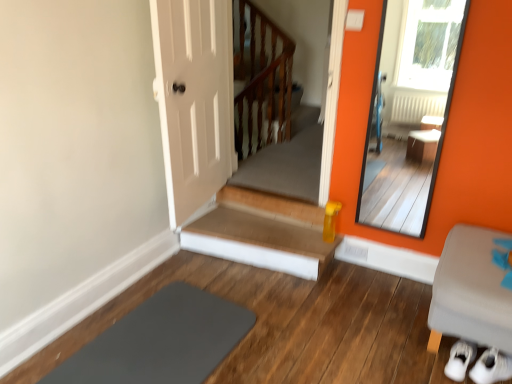
At what (x,y) coordinates should I click in order to perform the action: click on vacant space situated on the left part of gray fabric ottoman at lower right. Please return your answer as a coordinate pair (x, y). The height and width of the screenshot is (384, 512). Looking at the image, I should click on (370, 329).